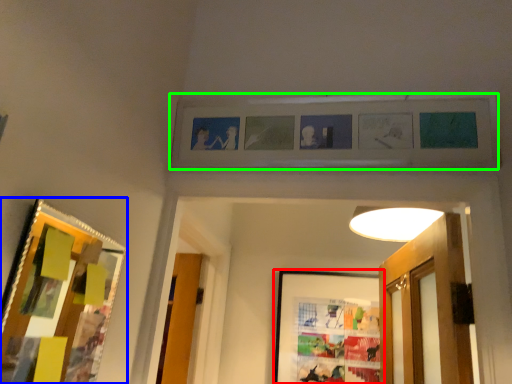
Question: Based on their relative distances, which object is nearer to picture frame (highlighted by a red box)? Choose from picture frame (highlighted by a blue box) and picture frame (highlighted by a green box).

Choices:
 (A) picture frame
 (B) picture frame

Answer: (B)